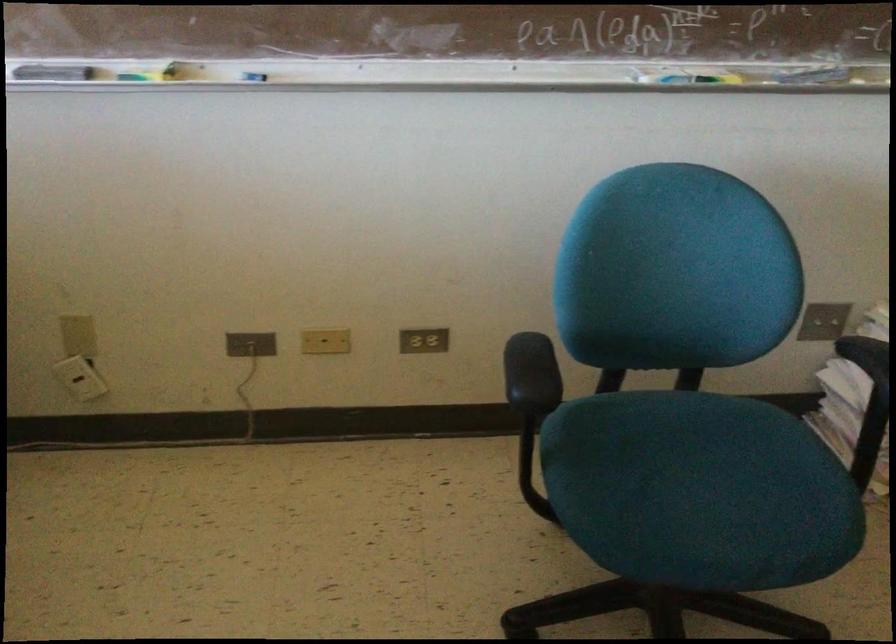
Locate an element on the screen. The width and height of the screenshot is (896, 644). blue chair sitting surface is located at coordinates (700, 491).